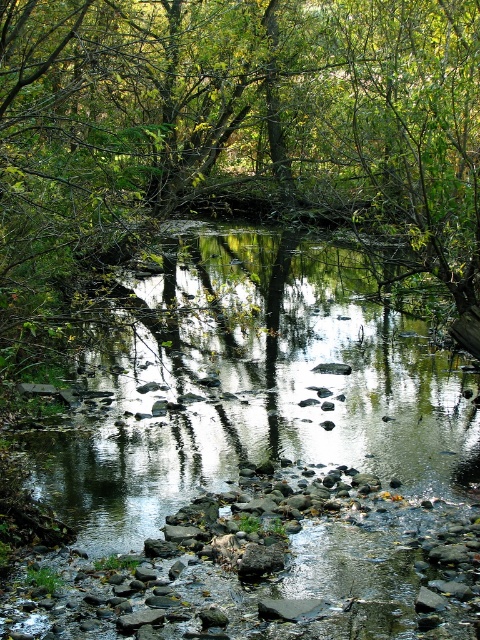
This screenshot has width=480, height=640. I want to click on green leafy tree at center, so click(241, 129).